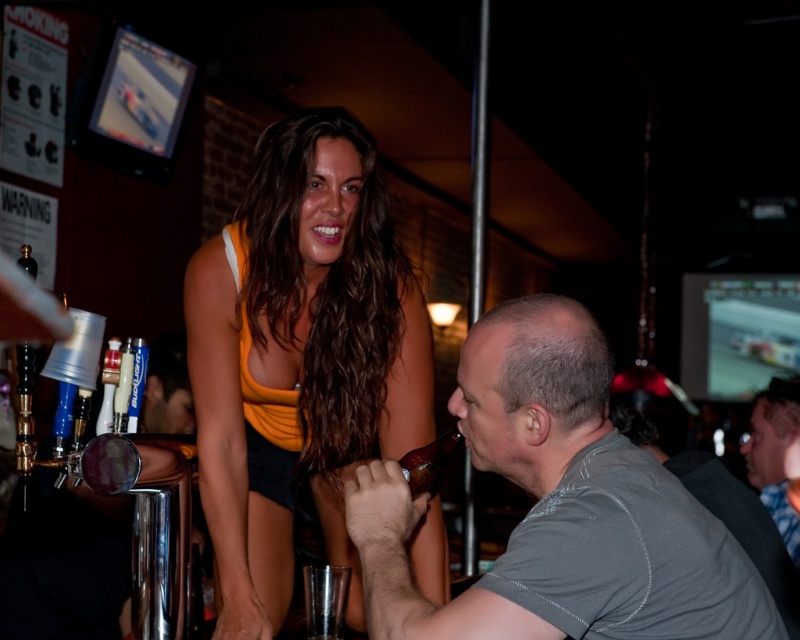
From the picture: You are a bartender preparing to serve drinks to the people in the scene. You have a tray that can hold items up to 1 meter in width. The orange fabric top at center and gray fabric shirt at upper right are near the tray. Can both items be placed on the tray without exceeding its width capacity?

The orange fabric top at center is wider than the gray fabric shirt at upper right. Since the orange fabric top at center alone surpasses the gray fabric shirt at upper right in width, placing both together would likely exceed the tray capacity of 1 meter. Therefore, they cannot both be placed on the tray without exceeding its width capacity.

You are a bartender at the bar. You need to place a coaster under the brown glass bottle at lower center to prevent water marks. The coaster is 3 inches in diameter. Can the coaster fit under the gray matte shirt at center without overlapping?

The gray matte shirt at center has a greater height compared to the brown glass bottle at lower center. Since the coaster is placed under the bottle, the height of the shirt is irrelevant to the coaster fitting under the bottle. The coaster can be placed under the brown glass bottle at lower center as long as there is enough space on the bar surface.

You are standing at the entrance of the bar and want to locate the orange fabric top at center. According to the coordinates provided, where would you look to find it?

The orange fabric top at center is located at the coordinates point (300, 358), which would be in the central area of the image.